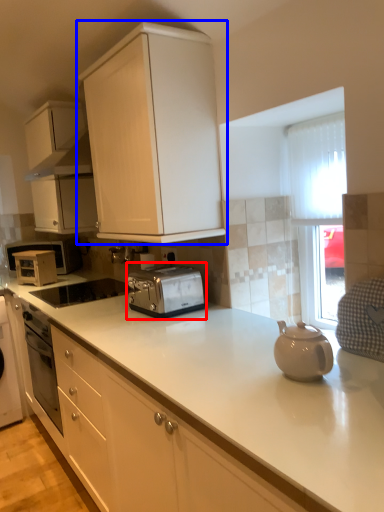
Question: Which point is closer to the camera, toaster (highlighted by a red box) or cabinetry (highlighted by a blue box)?

Choices:
 (A) toaster
 (B) cabinetry

Answer: (B)